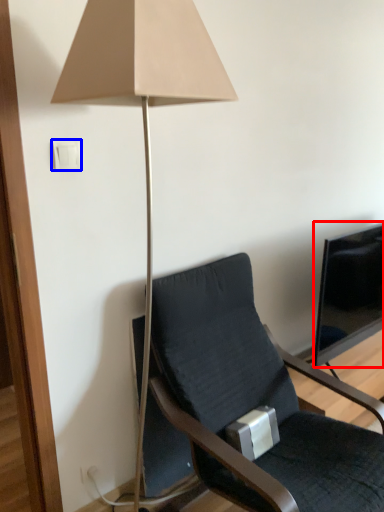
Question: Among these objects, which one is farthest to the camera, television (highlighted by a red box) or light switch (highlighted by a blue box)?

Choices:
 (A) television
 (B) light switch

Answer: (A)